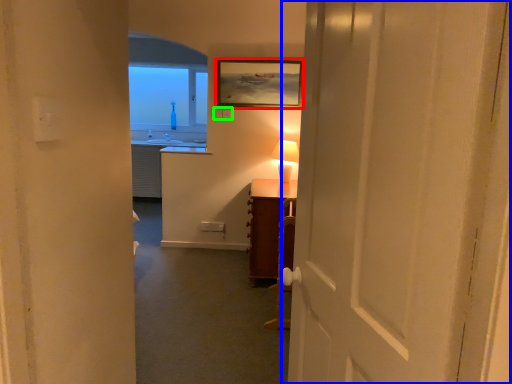
Question: Estimate the real-world distances between objects in this image. Which object is farther from picture frame (highlighted by a red box), door (highlighted by a blue box) or electric outlet (highlighted by a green box)?

Choices:
 (A) door
 (B) electric outlet

Answer: (A)